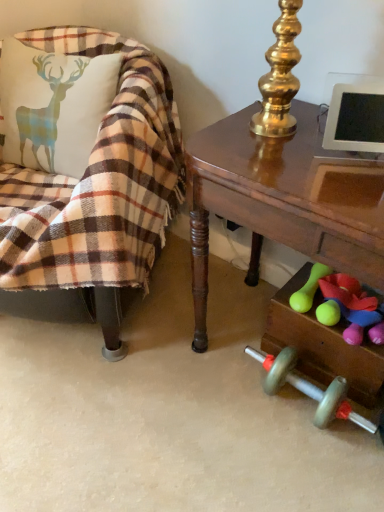
Measure the distance between point (361, 97) and camera.

Point (361, 97) and camera are 84.50 centimeters apart.

Measure the distance between point (94, 97) and camera.

1.21 meters.

The width and height of the screenshot is (384, 512). What are the coordinates of `shiny brown desk at right` in the screenshot? It's located at (283, 200).

How much space does rubberized green dumbbell at lower right, acting as the first toy starting from the right, occupy horizontally?

rubberized green dumbbell at lower right, acting as the first toy starting from the right, is 15.84 centimeters wide.

What are the coordinates of `rubberized green dumbbell at lower right, acting as the first toy starting from the right` in the screenshot? It's located at [354, 308].

Locate an element on the screen. The width and height of the screenshot is (384, 512). green rubber dumbbell at lower right, the 2th toy in the right-to-left sequence is located at coordinates (308, 289).

The width and height of the screenshot is (384, 512). I want to click on black glossy tablet at upper right, so click(x=355, y=118).

From a real-world perspective, is green rubber dumbbell at lower right, the 1th toy in the left-to-right sequence, physically located above or below rubberized green dumbbell at lower right, which is the second toy in left-to-right order?

Clearly, from a real-world perspective, green rubber dumbbell at lower right, the 1th toy in the left-to-right sequence, is below rubberized green dumbbell at lower right, which is the second toy in left-to-right order.

What's the angular difference between green rubber dumbbell at lower right, the 1th toy in the left-to-right sequence, and rubberized green dumbbell at lower right, acting as the first toy starting from the right,'s facing directions?

They differ by 0.000951 degrees in their facing directions.

Would you say green rubber dumbbell at lower right, the 2th toy in the right-to-left sequence, is outside rubberized green dumbbell at lower right, which is the second toy in left-to-right order?

Absolutely, green rubber dumbbell at lower right, the 2th toy in the right-to-left sequence, is external to rubberized green dumbbell at lower right, which is the second toy in left-to-right order.

From the image's perspective, is green rubber dumbbell at lower right, the 1th toy in the left-to-right sequence, above rubberized green dumbbell at lower right, which is the second toy in left-to-right order?

Correct, green rubber dumbbell at lower right, the 1th toy in the left-to-right sequence, appears higher than rubberized green dumbbell at lower right, which is the second toy in left-to-right order, in the image.

Considering the sizes of black glossy tablet at upper right and green rubber dumbbell at lower right, the 1th toy in the left-to-right sequence, in the image, is black glossy tablet at upper right bigger or smaller than green rubber dumbbell at lower right, the 1th toy in the left-to-right sequence,?

black glossy tablet at upper right is bigger than green rubber dumbbell at lower right, the 1th toy in the left-to-right sequence.

Who is more distant, black glossy tablet at upper right or green rubber dumbbell at lower right, the 2th toy in the right-to-left sequence?

green rubber dumbbell at lower right, the 2th toy in the right-to-left sequence.

From a real-world perspective, who is located lower, black glossy tablet at upper right or green rubber dumbbell at lower right, the 2th toy in the right-to-left sequence?

From a 3D spatial view, green rubber dumbbell at lower right, the 2th toy in the right-to-left sequence, is below.

Is black glossy tablet at upper right oriented towards green rubber dumbbell at lower right, the 2th toy in the right-to-left sequence?

No, black glossy tablet at upper right is not facing towards green rubber dumbbell at lower right, the 2th toy in the right-to-left sequence.

From a real-world perspective, which is physically above, shiny brown desk at right or green rubber dumbbell at lower right, the 1th toy in the left-to-right sequence?

shiny brown desk at right is physically above.

Is shiny brown desk at right positioned before green rubber dumbbell at lower right, the 2th toy in the right-to-left sequence?

Yes, shiny brown desk at right is closer to the camera.

Which is behind, point (280, 223) or point (303, 286)?

Positioned behind is point (303, 286).

How many degrees apart are the facing directions of shiny brown desk at right and green rubber dumbbell at lower right, the 2th toy in the right-to-left sequence?

They differ by 0.00123 degrees in their facing directions.

Is plaid fabric chair at left taller than shiny brown desk at right?

Correct, plaid fabric chair at left is much taller as shiny brown desk at right.

Does plaid fabric chair at left have a lesser width compared to shiny brown desk at right?

No, plaid fabric chair at left is not thinner than shiny brown desk at right.

Is plaid fabric chair at left turned away from shiny brown desk at right?

No, plaid fabric chair at left is not facing away from shiny brown desk at right.

From the image's perspective, would you say shiny brown desk at right is positioned over plaid fabric chair at left?

No, from the image's perspective, shiny brown desk at right is not above plaid fabric chair at left.

Which is more to the left, shiny brown desk at right or plaid fabric chair at left?

plaid fabric chair at left.

Is shiny brown desk at right looking in the opposite direction of plaid fabric chair at left?

shiny brown desk at right is not turned away from plaid fabric chair at left.

From a real-world perspective, is shiny brown desk at right located beneath plaid fabric chair at left?

Yes.

Is green rubber dumbbell at lower right, the 1th toy in the left-to-right sequence, directly adjacent to black glossy tablet at upper right?

No, green rubber dumbbell at lower right, the 1th toy in the left-to-right sequence, is not making contact with black glossy tablet at upper right.

From a real-world perspective, is green rubber dumbbell at lower right, the 2th toy in the right-to-left sequence, located higher than black glossy tablet at upper right?

Actually, green rubber dumbbell at lower right, the 2th toy in the right-to-left sequence, is physically below black glossy tablet at upper right in the real world.

Does point (309, 280) come behind point (379, 146)?

Yes, it is behind point (379, 146).

Can black glossy tablet at upper right be found inside green rubber dumbbell at lower right, the 1th toy in the left-to-right sequence?

No, black glossy tablet at upper right is not surrounded by green rubber dumbbell at lower right, the 1th toy in the left-to-right sequence.

Is point (354, 284) closer or farther from the camera than point (357, 150)?

Point (354, 284).

From the image's perspective, would you say rubberized green dumbbell at lower right, which is the second toy in left-to-right order, is shown under black glossy tablet at upper right?

Yes, from the image's perspective, rubberized green dumbbell at lower right, which is the second toy in left-to-right order, is beneath black glossy tablet at upper right.

Can you tell me how much rubberized green dumbbell at lower right, which is the second toy in left-to-right order, and black glossy tablet at upper right differ in facing direction?

31.4 degrees separate the facing orientations of rubberized green dumbbell at lower right, which is the second toy in left-to-right order, and black glossy tablet at upper right.

Locate an element on the screen. The image size is (384, 512). toy located on the right of black glossy tablet at upper right is located at coordinates (354, 308).

The height and width of the screenshot is (512, 384). Find the location of `toy that appears above the rubberized green dumbbell at lower right, which is the second toy in left-to-right order (from the image's perspective)`. toy that appears above the rubberized green dumbbell at lower right, which is the second toy in left-to-right order (from the image's perspective) is located at coordinates (308, 289).

At what (x,y) coordinates should I click in order to perform the action: click on the 2nd toy behind the black glossy tablet at upper right, starting your count from the anchor. Please return your answer as a coordinate pair (x, y). This screenshot has height=512, width=384. Looking at the image, I should click on (308, 289).

Which object lies further to the anchor point black glossy tablet at upper right, rubberized green dumbbell at lower right, which is the second toy in left-to-right order, or plaid fabric pillow at left?

plaid fabric pillow at left is further to black glossy tablet at upper right.

From the image, which object appears to be nearer to shiny brown desk at right, black glossy tablet at upper right or plaid fabric chair at left?

Based on the image, black glossy tablet at upper right appears to be nearer to shiny brown desk at right.

Estimate the real-world distances between objects in this image. Which object is further from green rubber dumbbell at lower right, the 2th toy in the right-to-left sequence, shiny brown desk at right or rubberized green dumbbell at lower right, acting as the first toy starting from the right?

shiny brown desk at right.

In the scene shown: Looking at the image, which one is located closer to green rubber dumbbell at lower right, the 2th toy in the right-to-left sequence, black glossy tablet at upper right or plaid fabric chair at left?

Based on the image, black glossy tablet at upper right appears to be nearer to green rubber dumbbell at lower right, the 2th toy in the right-to-left sequence.

Looking at the image, which one is located closer to plaid fabric chair at left, green rubber dumbbell at lower right, the 2th toy in the right-to-left sequence, or rubberized green dumbbell at lower right, which is the second toy in left-to-right order?

green rubber dumbbell at lower right, the 2th toy in the right-to-left sequence.

From the image, which object appears to be farther from shiny brown desk at right, plaid fabric chair at left or plaid fabric pillow at left?

Based on the image, plaid fabric pillow at left appears to be further to shiny brown desk at right.

In the scene shown: From the image, which object appears to be nearer to black glossy tablet at upper right, green rubber dumbbell at lower right, the 2th toy in the right-to-left sequence, or shiny brown desk at right?

shiny brown desk at right.

Looking at the image, which one is located further to rubberized green dumbbell at lower right, acting as the first toy starting from the right, plaid fabric chair at left or black glossy tablet at upper right?

Among the two, plaid fabric chair at left is located further to rubberized green dumbbell at lower right, acting as the first toy starting from the right.

At what (x,y) coordinates should I click in order to perform the action: click on pillow located between plaid fabric chair at left and rubberized green dumbbell at lower right, which is the second toy in left-to-right order, in the left-right direction. Please return your answer as a coordinate pair (x, y). The width and height of the screenshot is (384, 512). Looking at the image, I should click on (53, 106).

Locate an element on the screen. The height and width of the screenshot is (512, 384). computer monitor between shiny brown desk at right and green rubber dumbbell at lower right, the 1th toy in the left-to-right sequence, along the z-axis is located at coordinates (355, 118).

This screenshot has width=384, height=512. What are the coordinates of `pillow between plaid fabric chair at left and shiny brown desk at right` in the screenshot? It's located at (53, 106).

Where is `pillow between plaid fabric chair at left and green rubber dumbbell at lower right, the 1th toy in the left-to-right sequence, from left to right`? pillow between plaid fabric chair at left and green rubber dumbbell at lower right, the 1th toy in the left-to-right sequence, from left to right is located at coordinates (53, 106).